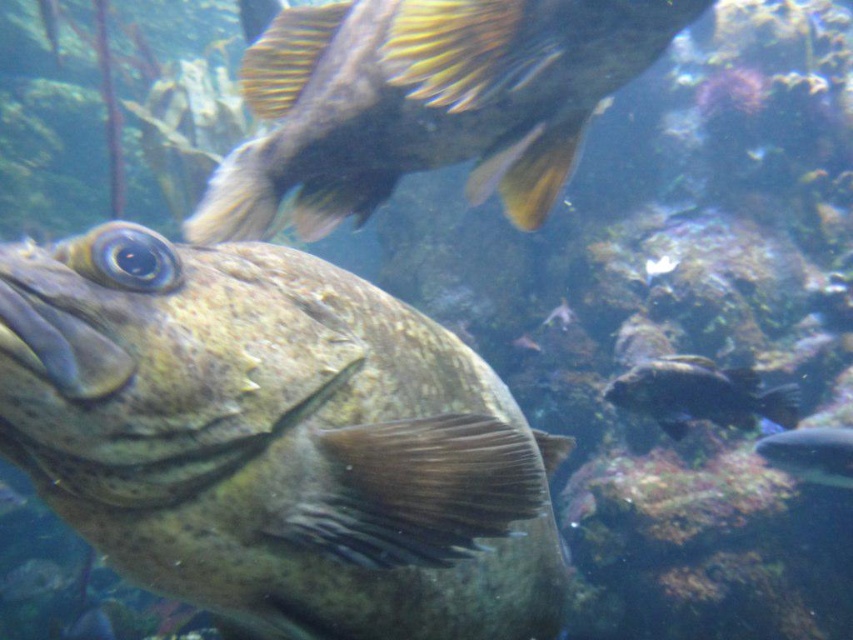
Is the position of shiny black fish at upper center more distant than that of speckled brown fish at lower right?

That is False.

Between point (659, 35) and point (769, 444), which one is positioned behind?

The point (769, 444) is behind.

Where is `shiny black fish at upper center`? The image size is (853, 640). shiny black fish at upper center is located at coordinates (424, 102).

Who is shorter, dark brown textured fish at lower right or speckled brown fish at lower right?

With less height is speckled brown fish at lower right.

Is dark brown textured fish at lower right to the left of speckled brown fish at lower right from the viewer's perspective?

Indeed, dark brown textured fish at lower right is positioned on the left side of speckled brown fish at lower right.

Which is in front, point (698, 406) or point (833, 481)?

Point (698, 406) is in front.

I want to click on dark brown textured fish at lower right, so click(700, 394).

Between speckled brown fish at center and shiny black fish at upper center, which one appears on the right side from the viewer's perspective?

From the viewer's perspective, speckled brown fish at center appears more on the right side.

Is speckled brown fish at center positioned behind shiny black fish at upper center?

No, speckled brown fish at center is closer to the viewer.

Find the location of a particular element. The width and height of the screenshot is (853, 640). speckled brown fish at center is located at coordinates (276, 440).